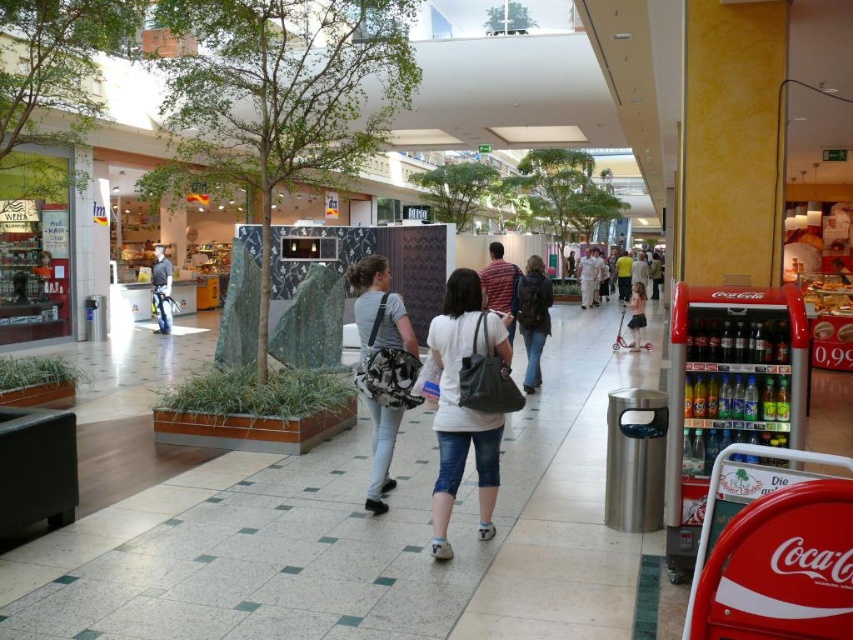
Question: Can you confirm if denim jacket at center is positioned to the right of pink satin dress at center?

Choices:
 (A) yes
 (B) no

Answer: (B)

Question: Which point appears farthest from the camera in this image?

Choices:
 (A) (527, 333)
 (B) (631, 292)

Answer: (B)

Question: Which object is positioned closest to the camouflage-patterned bag at center?

Choices:
 (A) denim jacket at center
 (B) white matte backpack at center
 (C) pink satin dress at center
 (D) white tile pavement at center

Answer: (B)

Question: Among these objects, which one is farthest from the camera?

Choices:
 (A) white tile pavement at center
 (B) denim jacket at center
 (C) camouflage-patterned bag at center
 (D) pink satin dress at center

Answer: (D)

Question: Is white tile pavement at center wider than white matte backpack at center?

Choices:
 (A) no
 (B) yes

Answer: (B)

Question: Where is denim jacket at center located in relation to pink satin dress at center in the image?

Choices:
 (A) above
 (B) below

Answer: (B)